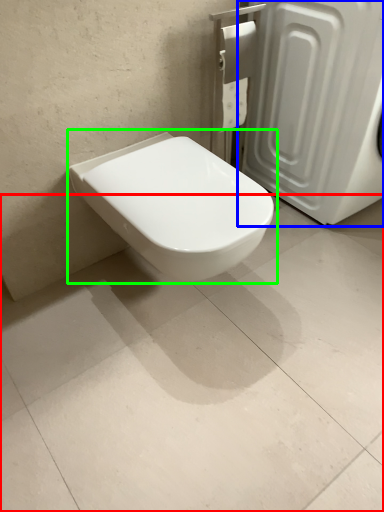
Question: Which object is positioned closest to concrete (highlighted by a red box)? Select from screen door (highlighted by a blue box) and toilet (highlighted by a green box).

Choices:
 (A) screen door
 (B) toilet

Answer: (B)